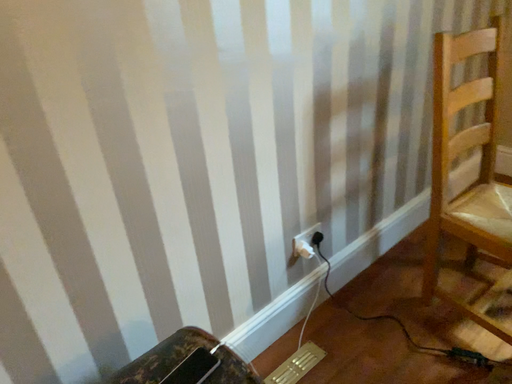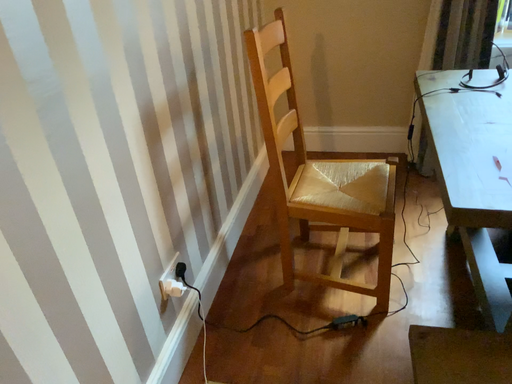
Question: How did the camera likely rotate when shooting the video?

Choices:
 (A) rotated left
 (B) rotated right

Answer: (B)